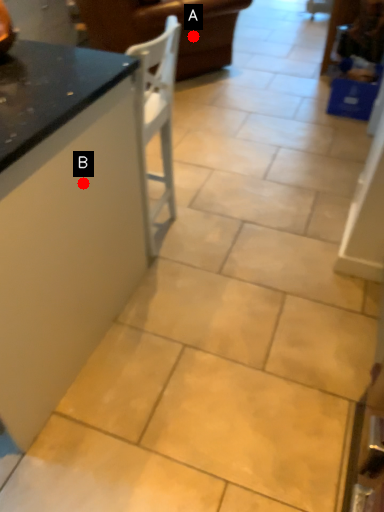
Question: Two points are circled on the image, labeled by A and B beside each circle. Which of the following is the closest to the observer?

Choices:
 (A) A is closer
 (B) B is closer

Answer: (B)